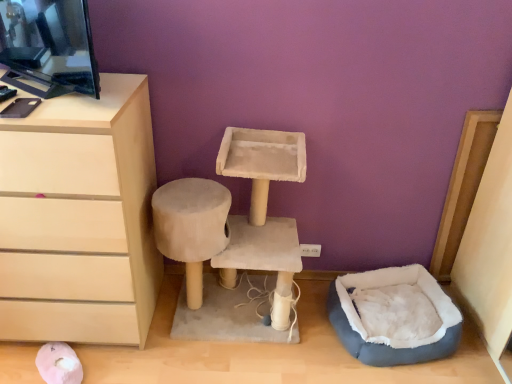
Locate an element on the screen. The image size is (512, 384). matte beige chest of drawers at left is located at coordinates (79, 218).

Find the location of a particular element. The height and width of the screenshot is (384, 512). vanity to the left of gray plush bean bag at lower right is located at coordinates (234, 238).

Looking at this image, is beige suede cat tree at center next to gray plush bean bag at lower right?

beige suede cat tree at center and gray plush bean bag at lower right are not in contact.

Considering the relative sizes of beige suede cat tree at center and gray plush bean bag at lower right in the image provided, is beige suede cat tree at center taller than gray plush bean bag at lower right?

Yes.

From a real-world perspective, is beige suede cat tree at center above or below gray plush bean bag at lower right?

In terms of real-world spatial position, beige suede cat tree at center is above gray plush bean bag at lower right.

Which of these two, gray plush bean bag at lower right or matte beige chest of drawers at left, stands taller?

Standing taller between the two is matte beige chest of drawers at left.

Is gray plush bean bag at lower right touching matte beige chest of drawers at left?

No, gray plush bean bag at lower right is not in contact with matte beige chest of drawers at left.

Between gray plush bean bag at lower right and matte beige chest of drawers at left, which one has smaller width?

With smaller width is gray plush bean bag at lower right.

This screenshot has width=512, height=384. I want to click on chest of drawers in front of the gray plush bean bag at lower right, so click(x=79, y=218).

From a real-world perspective, who is located lower, beige suede cat tree at center or matte beige chest of drawers at left?

beige suede cat tree at center is physically lower.

Considering the sizes of beige suede cat tree at center and matte beige chest of drawers at left in the image, is beige suede cat tree at center taller or shorter than matte beige chest of drawers at left?

In the image, beige suede cat tree at center appears to be shorter than matte beige chest of drawers at left.

Based on the photo, can you tell me how much beige suede cat tree at center and matte beige chest of drawers at left differ in facing direction?

The angular difference between beige suede cat tree at center and matte beige chest of drawers at left is 0.0326 degrees.

Is gray plush bean bag at lower right oriented towards beige suede cat tree at center?

No, gray plush bean bag at lower right is not turned towards beige suede cat tree at center.

From the image's perspective, which one is positioned lower, gray plush bean bag at lower right or beige suede cat tree at center?

From the image's view, gray plush bean bag at lower right is below.

Is beige suede cat tree at center a part of gray plush bean bag at lower right?

No, gray plush bean bag at lower right does not contain beige suede cat tree at center.

The image size is (512, 384). In order to click on the chest of drawers located above the gray plush bean bag at lower right (from a real-world perspective) in this screenshot , I will do `click(79, 218)`.

Which is closer to the camera, [79,181] or [433,331]?

The point [79,181] is closer to the camera.

From the image's perspective, between matte beige chest of drawers at left and gray plush bean bag at lower right, which one is located above?

matte beige chest of drawers at left appears higher in the image.

Is matte beige chest of drawers at left positioned with its back to gray plush bean bag at lower right?

matte beige chest of drawers at left does not have its back to gray plush bean bag at lower right.

Which of these two, matte beige chest of drawers at left or beige suede cat tree at center, stands shorter?

With less height is beige suede cat tree at center.

In the scene shown: Can you confirm if matte beige chest of drawers at left is thinner than beige suede cat tree at center?

Incorrect, the width of matte beige chest of drawers at left is not less than that of beige suede cat tree at center.

Does point (45, 328) appear closer or farther from the camera than point (209, 320)?

Clearly, point (45, 328) is closer to the camera than point (209, 320).

Is matte beige chest of drawers at left surrounding beige suede cat tree at center?

No, beige suede cat tree at center is not a part of matte beige chest of drawers at left.

Find the location of a particular element. This screenshot has height=384, width=512. bean bag chair lying behind the beige suede cat tree at center is located at coordinates (394, 316).

Locate an element on the screen. bean bag chair lying below the matte beige chest of drawers at left (from the image's perspective) is located at coordinates (394, 316).

Estimate the real-world distances between objects in this image. Which object is further from matte beige chest of drawers at left, beige suede cat tree at center or gray plush bean bag at lower right?

gray plush bean bag at lower right lies further to matte beige chest of drawers at left than the other object.

Consider the image. When comparing their distances from beige suede cat tree at center, does gray plush bean bag at lower right or matte beige chest of drawers at left seem closer?

The object closer to beige suede cat tree at center is matte beige chest of drawers at left.

Which object lies nearer to the anchor point gray plush bean bag at lower right, beige suede cat tree at center or matte beige chest of drawers at left?

beige suede cat tree at center.

Which object lies further to the anchor point beige suede cat tree at center, matte beige chest of drawers at left or gray plush bean bag at lower right?

The object further to beige suede cat tree at center is gray plush bean bag at lower right.

When comparing their distances from gray plush bean bag at lower right, does matte beige chest of drawers at left or beige suede cat tree at center seem further?

matte beige chest of drawers at left is positioned further to the anchor gray plush bean bag at lower right.

Consider the image. Based on their spatial positions, is gray plush bean bag at lower right or beige suede cat tree at center closer to matte beige chest of drawers at left?

beige suede cat tree at center is positioned closer to the anchor matte beige chest of drawers at left.

The width and height of the screenshot is (512, 384). Find the location of `vanity situated between matte beige chest of drawers at left and gray plush bean bag at lower right from left to right`. vanity situated between matte beige chest of drawers at left and gray plush bean bag at lower right from left to right is located at coordinates [234, 238].